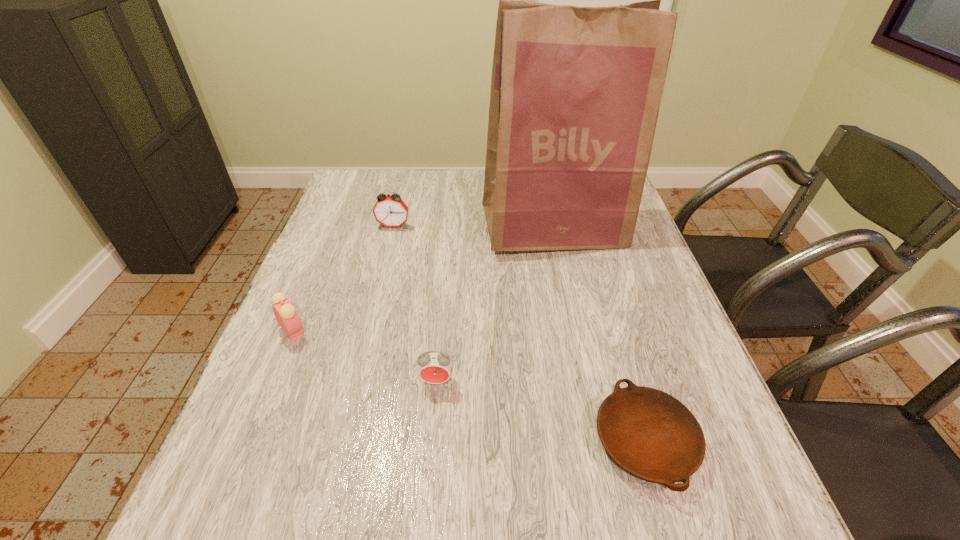
Image resolution: width=960 pixels, height=540 pixels. I want to click on the tallest object, so (575, 93).

Identify the location of the second alarm clock from right to left. (390, 211).

Locate an element on the screen. The height and width of the screenshot is (540, 960). the fourth shortest object is located at coordinates (390, 211).

Find the location of `the rightmost alarm clock`. the rightmost alarm clock is located at coordinates (434, 367).

The height and width of the screenshot is (540, 960). What are the coordinates of `the third object from left to right` in the screenshot? It's located at (434, 367).

Find the location of a particular element. the leftmost object is located at coordinates (287, 317).

Find the location of a particular element. Image resolution: width=960 pixels, height=540 pixels. the leftmost alarm clock is located at coordinates (287, 317).

Identify the location of plate. The image size is (960, 540). (650, 434).

At what (x,y) coordinates should I click in order to perform the action: click on the nearest object. Please return your answer as a coordinate pair (x, y). The image size is (960, 540). Looking at the image, I should click on (650, 434).

Where is `vacant space located on the front-facing side of the tallest object`? Image resolution: width=960 pixels, height=540 pixels. vacant space located on the front-facing side of the tallest object is located at coordinates (567, 292).